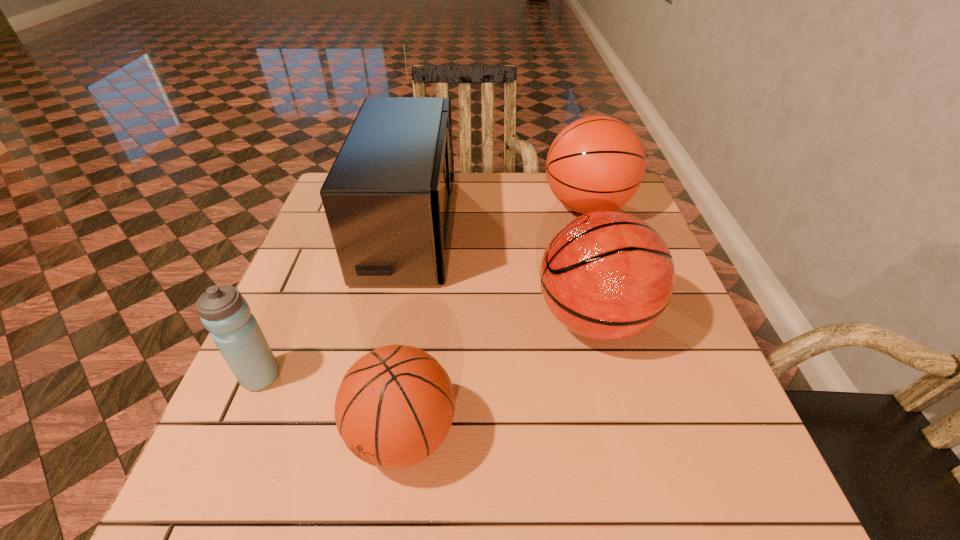
At what (x,y) coordinates should I click in order to perform the action: click on microwave_oven. Please return your answer as a coordinate pair (x, y). The width and height of the screenshot is (960, 540). Looking at the image, I should click on (387, 197).

The width and height of the screenshot is (960, 540). Identify the location of the farthest basketball. (597, 163).

Where is `the second nearest basketball`? the second nearest basketball is located at coordinates (606, 275).

At what (x,y) coordinates should I click in order to perform the action: click on water bottle. Please return your answer as a coordinate pair (x, y). The height and width of the screenshot is (540, 960). Looking at the image, I should click on (224, 312).

This screenshot has height=540, width=960. In order to click on the shortest basketball in this screenshot , I will do `click(395, 406)`.

Where is `the shortest object`? the shortest object is located at coordinates (395, 406).

Where is `blank area located on the front-facing side of the microwave_oven`? blank area located on the front-facing side of the microwave_oven is located at coordinates (577, 227).

Locate an element on the screen. This screenshot has height=540, width=960. free space located on the front of the farthest basketball is located at coordinates (615, 300).

Identify the location of free location located 0.260m on the side with spill of the second nearest basketball. This screenshot has height=540, width=960. (414, 319).

Locate an element on the screen. This screenshot has height=540, width=960. vacant area situated 0.140m on the side with spill of the second nearest basketball is located at coordinates (469, 319).